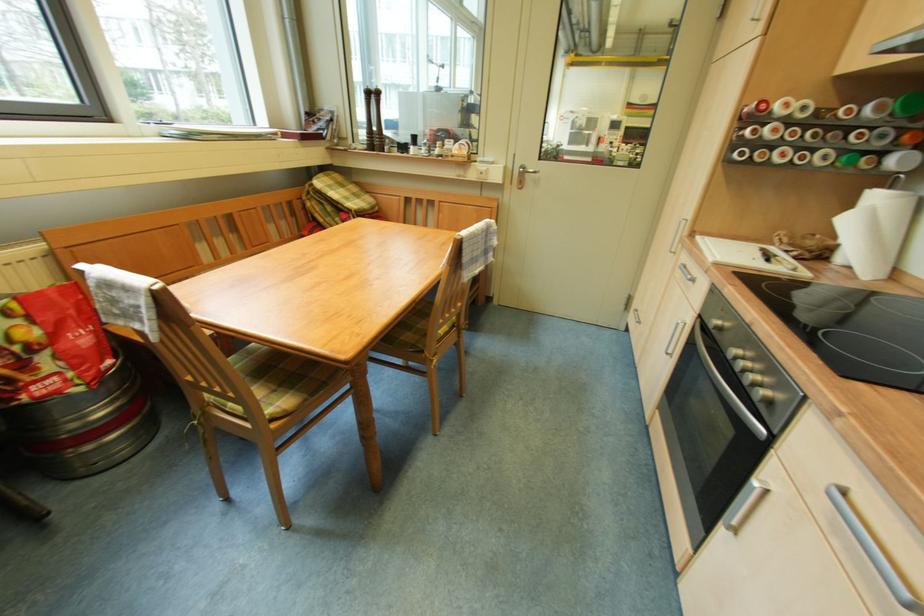
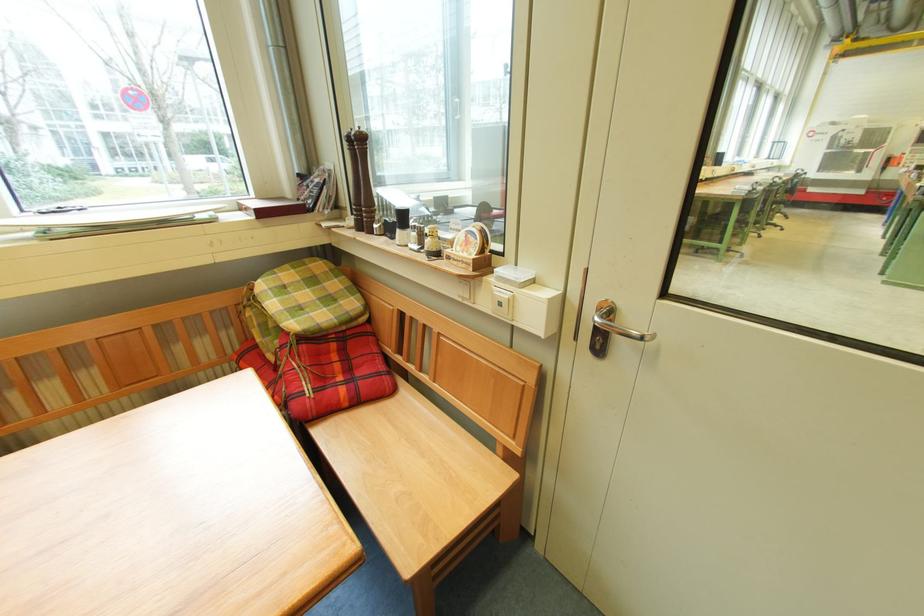
Find the pixel in the second image that matches point 490,176 in the first image.

(507, 307)